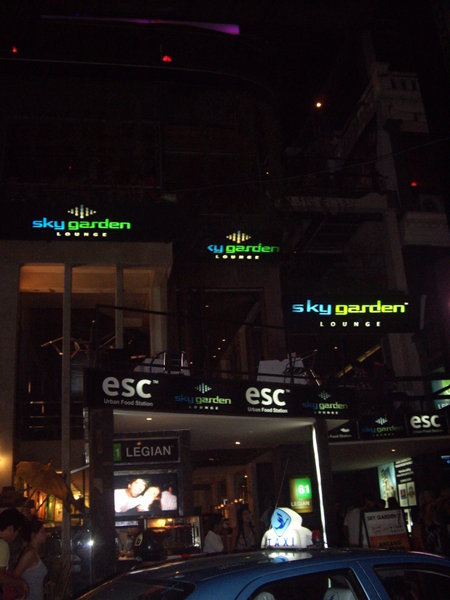
What are the coordinates of `light` in the screenshot? It's located at (278, 529).